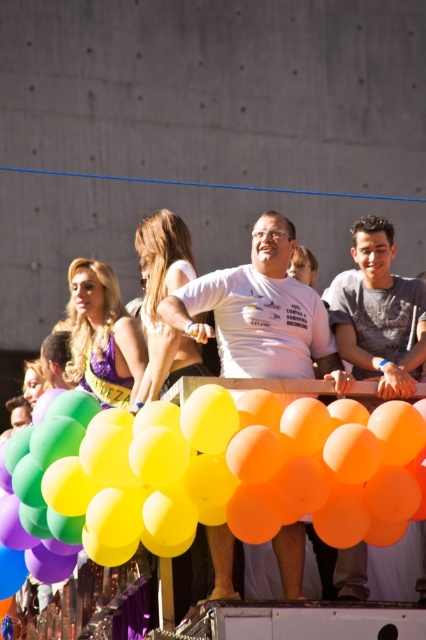
Question: Does rubber balloons at center have a lesser width compared to white matte shirt at center?

Choices:
 (A) no
 (B) yes

Answer: (A)

Question: Which point is farther from the camera taking this photo?

Choices:
 (A) (94, 284)
 (B) (380, 464)
 (C) (299, 561)
 (D) (187, 273)

Answer: (A)

Question: Does shiny purple dress at center appear on the left side of matte white shirt at center?

Choices:
 (A) yes
 (B) no

Answer: (A)

Question: Is rubber balloons at center below shiny purple dress at center?

Choices:
 (A) no
 (B) yes

Answer: (B)

Question: Among these objects, which one is farthest from the camera?

Choices:
 (A) shiny purple dress at center
 (B) white matte shirt at center
 (C) rubber balloons at center
 (D) matte white shirt at center

Answer: (A)

Question: Which is nearer to the shiny purple dress at center?

Choices:
 (A) matte white shirt at center
 (B) white matte shirt at center

Answer: (A)